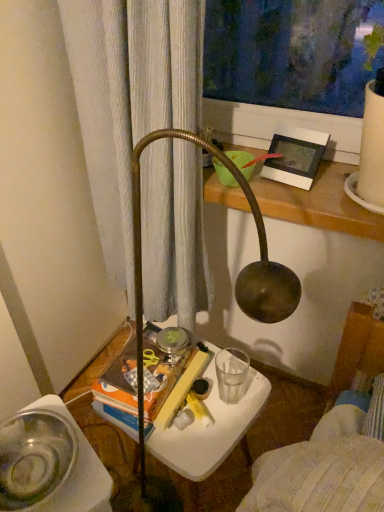
Locate an element on the screen. The height and width of the screenshot is (512, 384). unoccupied area in front of clear glass water at lower center is located at coordinates (223, 429).